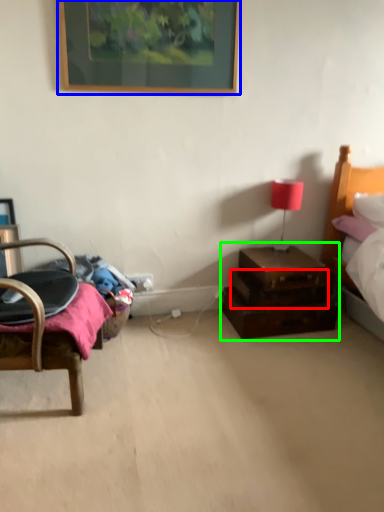
Question: Which is farther away from drawer (highlighted by a red box)? picture frame (highlighted by a blue box) or nightstand (highlighted by a green box)?

Choices:
 (A) picture frame
 (B) nightstand

Answer: (A)